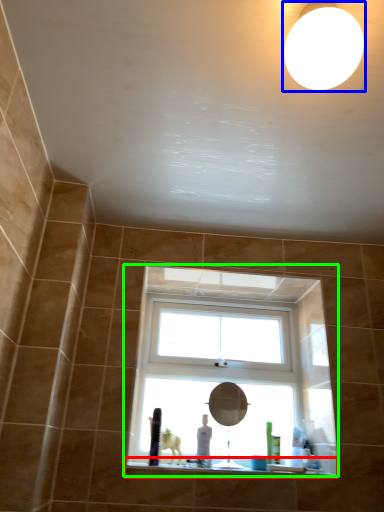
Question: Based on their relative distances, which object is nearer to window sill (highlighted by a red box)? Choose from lighting (highlighted by a blue box) and window (highlighted by a green box).

Choices:
 (A) lighting
 (B) window

Answer: (B)